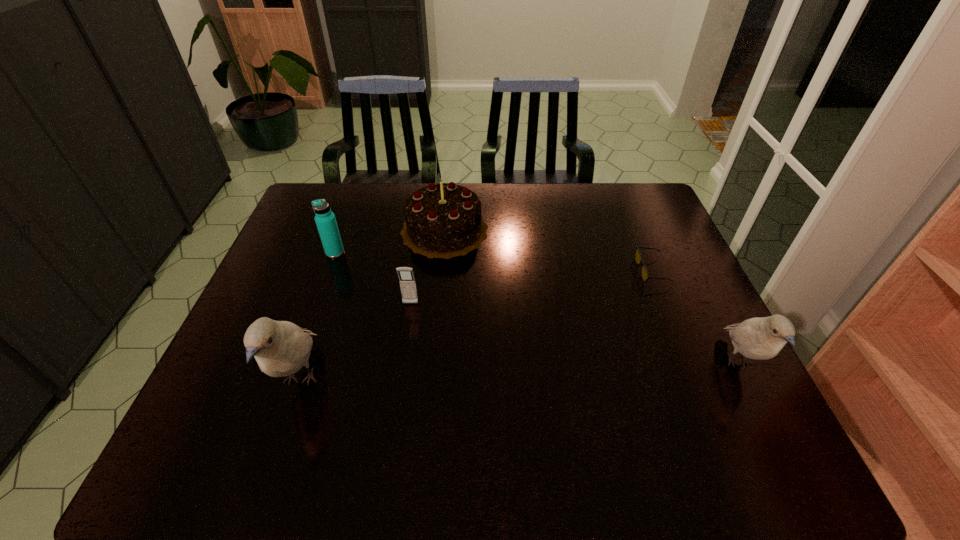
Find the location of a particular element. Image resolution: width=960 pixels, height=540 pixels. unoccupied position between the shortest object and the taller bird is located at coordinates (476, 326).

Locate an element on the screen. vacant space in between the water bottle and the shorter bird is located at coordinates (537, 308).

The height and width of the screenshot is (540, 960). What are the coordinates of `free space between the water bottle and the shorter bird` in the screenshot? It's located at point(537,308).

Locate an element on the screen. This screenshot has height=540, width=960. free space between the sunglasses and the cellular telephone is located at coordinates (531, 287).

Where is `vacant area that lies between the second object from right to left and the second shortest object`? Image resolution: width=960 pixels, height=540 pixels. vacant area that lies between the second object from right to left and the second shortest object is located at coordinates (531, 287).

Image resolution: width=960 pixels, height=540 pixels. In order to click on free spot between the sunglasses and the birthday cake in this screenshot , I will do `click(548, 251)`.

At what (x,y) coordinates should I click in order to perform the action: click on empty space that is in between the right bird and the taller bird. Please return your answer as a coordinate pair (x, y). This screenshot has width=960, height=540. Looking at the image, I should click on (519, 372).

Select which object appears as the second closest to the birthday cake. Please provide its 2D coordinates. Your answer should be formatted as a tuple, i.e. [(x, y)], where the tuple contains the x and y coordinates of a point satisfying the conditions above.

[(407, 282)]

Identify the location of object that can be found as the second closest to the right bird. (442, 220).

At what (x,y) coordinates should I click in order to perform the action: click on blank space that satisfies the following two spatial constraints: 1. on the front-facing side of the sunglasses; 2. on the front-facing side of the cellular telephone. Please return your answer as a coordinate pair (x, y). This screenshot has width=960, height=540. Looking at the image, I should click on (665, 304).